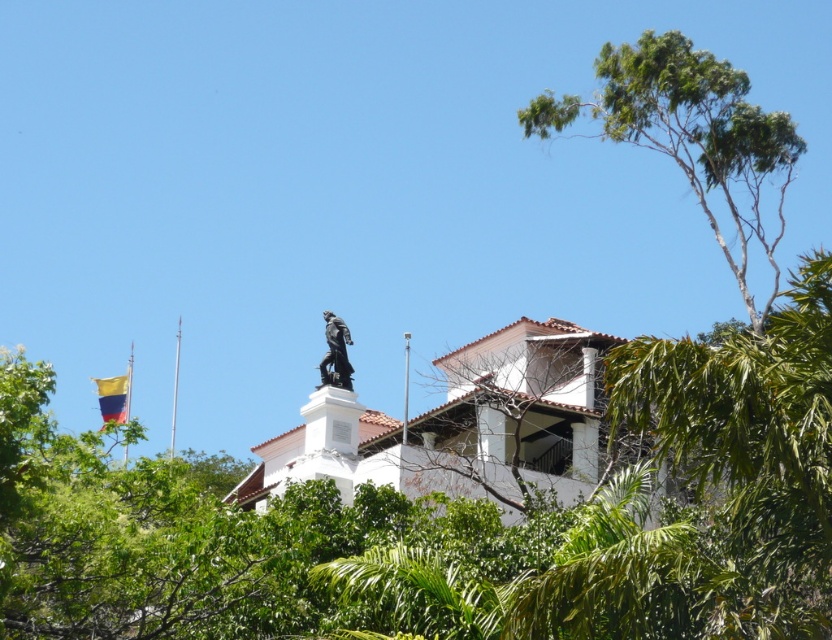
Does green leafy tree at upper right appear on the right side of polished bronze statue at upper center?

Indeed, green leafy tree at upper right is positioned on the right side of polished bronze statue at upper center.

Between green leafy tree at upper right and polished bronze statue at upper center, which one is positioned lower?

Positioned lower is polished bronze statue at upper center.

Describe the element at coordinates (692, 138) in the screenshot. Image resolution: width=832 pixels, height=640 pixels. I see `green leafy tree at upper right` at that location.

This screenshot has width=832, height=640. I want to click on green leafy tree at upper right, so click(692, 138).

Is point (786, 168) farther from viewer compared to point (174, 444)?

That is False.

What do you see at coordinates (692, 138) in the screenshot?
I see `green leafy tree at upper right` at bounding box center [692, 138].

Is point (691, 132) in front of point (174, 438)?

That is True.

The image size is (832, 640). Identify the location of green leafy tree at upper right. (692, 138).

Does green leafy tree at upper center come behind green leafy tree at upper right?

That is False.

Is green leafy tree at upper center below green leafy tree at upper right?

Correct, green leafy tree at upper center is located below green leafy tree at upper right.

At what (x,y) coordinates should I click in order to perform the action: click on green leafy tree at upper center. Please return your answer as a coordinate pair (x, y). The image size is (832, 640). Looking at the image, I should click on (456, 522).